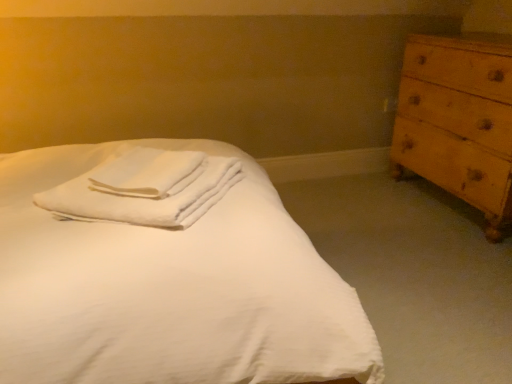
Question: Is white cotton towels at center positioned beyond the bounds of white soft towel at center?

Choices:
 (A) yes
 (B) no

Answer: (A)

Question: Is white cotton towels at center aimed at white soft towel at center?

Choices:
 (A) no
 (B) yes

Answer: (B)

Question: From the image's perspective, is white cotton towels at center on white soft towel at center?

Choices:
 (A) no
 (B) yes

Answer: (A)

Question: Are white cotton towels at center and white soft towel at center located far from each other?

Choices:
 (A) no
 (B) yes

Answer: (A)

Question: Considering the relative positions of white cotton towels at center and white soft towel at center in the image provided, is white cotton towels at center to the left of white soft towel at center from the viewer's perspective?

Choices:
 (A) no
 (B) yes

Answer: (B)

Question: From the image's perspective, is white cotton towels at center positioned above or below white soft towel at center?

Choices:
 (A) above
 (B) below

Answer: (B)

Question: Does point (214, 177) appear closer or farther from the camera than point (150, 187)?

Choices:
 (A) farther
 (B) closer

Answer: (A)

Question: Considering the positions of white cotton towels at center and white soft towel at center in the image, is white cotton towels at center wider or thinner than white soft towel at center?

Choices:
 (A) thin
 (B) wide

Answer: (B)

Question: Is white cotton towels at center bigger or smaller than white soft towel at center?

Choices:
 (A) small
 (B) big

Answer: (B)

Question: Is point (141, 172) positioned closer to the camera than point (309, 345)?

Choices:
 (A) closer
 (B) farther

Answer: (B)

Question: Is white cotton towels at center bigger or smaller than white smooth bed at center?

Choices:
 (A) small
 (B) big

Answer: (A)

Question: Is white cotton towels at center to the left or to the right of white smooth bed at center in the image?

Choices:
 (A) right
 (B) left

Answer: (A)

Question: From a real-world perspective, is white cotton towels at center above or below white smooth bed at center?

Choices:
 (A) below
 (B) above

Answer: (B)

Question: Is point (413, 147) positioned closer to the camera than point (131, 211)?

Choices:
 (A) closer
 (B) farther

Answer: (B)

Question: In terms of height, does wooden chest of drawers at right look taller or shorter compared to white smooth bed at center?

Choices:
 (A) short
 (B) tall

Answer: (B)